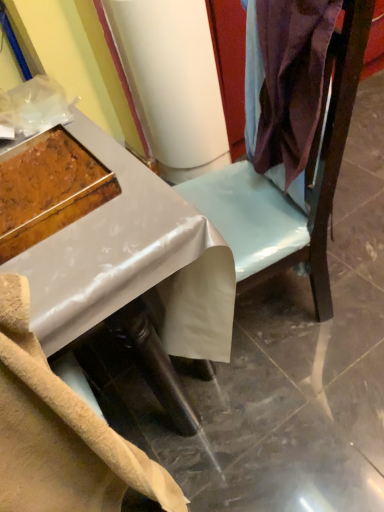
Where is `vacant area located to the right-hand side of wooden tray at left`? vacant area located to the right-hand side of wooden tray at left is located at coordinates (134, 194).